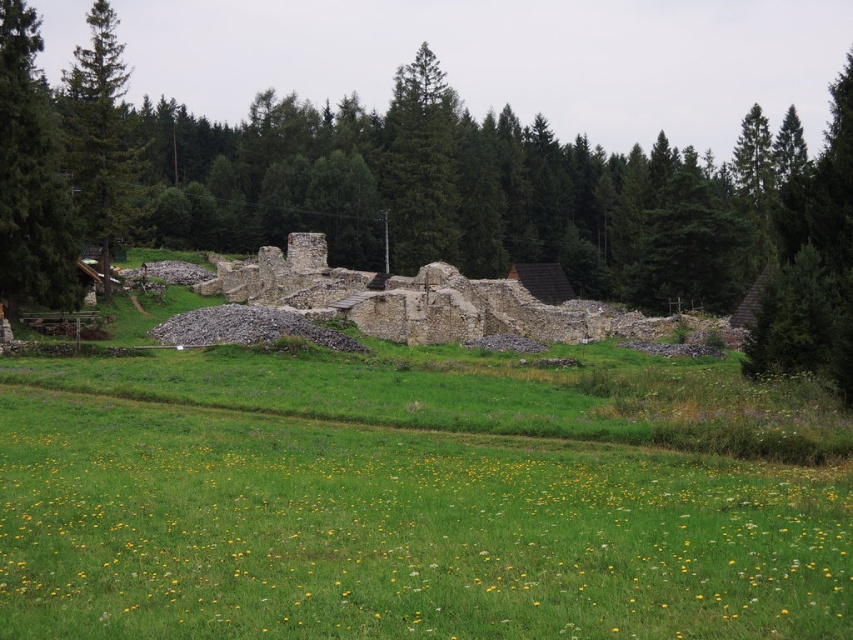
Question: Can you confirm if green textured tree at left is wider than green textured tree at center?

Choices:
 (A) yes
 (B) no

Answer: (B)

Question: Is green textured tree at left to the left of green coniferous tree at left from the viewer's perspective?

Choices:
 (A) yes
 (B) no

Answer: (B)

Question: Does green textured tree at left have a lesser width compared to green textured tree at center?

Choices:
 (A) yes
 (B) no

Answer: (A)

Question: Which object is the closest to the green coniferous tree at left?

Choices:
 (A) green textured tree at center
 (B) green leafy forest at center
 (C) green textured tree at left

Answer: (C)

Question: Which point is closer to the camera taking this photo?

Choices:
 (A) click(0, 300)
 (B) click(650, 289)
 (C) click(129, 179)
 (D) click(425, 182)

Answer: (A)

Question: Which of the following is the farthest from the observer?

Choices:
 (A) green textured tree at center
 (B) green textured tree at left
 (C) green coniferous tree at left

Answer: (A)